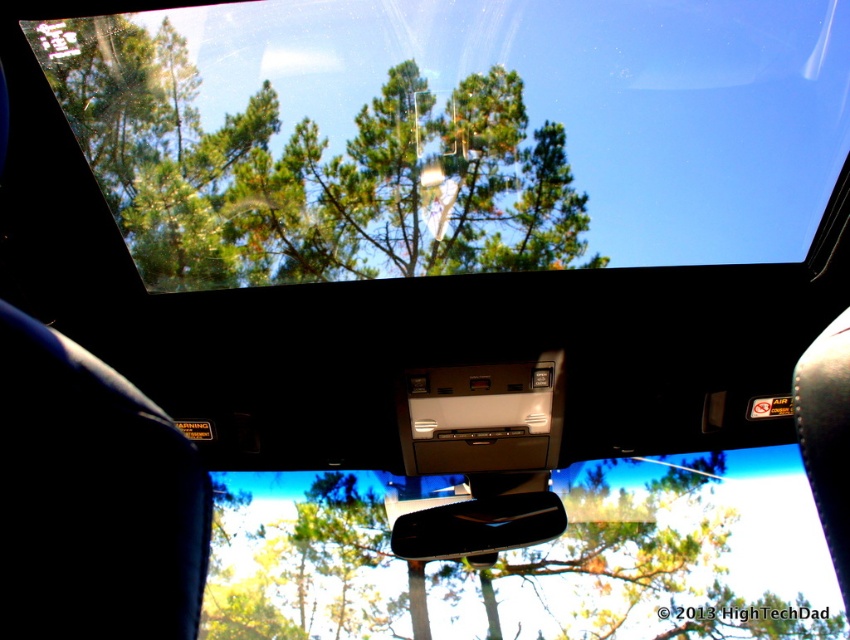
Question: Which object is positioned closest to the transparent glass windshield at upper center?

Choices:
 (A) black glossy car mirror at center
 (B) green matte tree at center

Answer: (A)

Question: Does green matte tree at center have a lesser width compared to black glossy car mirror at center?

Choices:
 (A) no
 (B) yes

Answer: (A)

Question: Can you confirm if transparent glass windshield at upper center is positioned above green matte tree at center?

Choices:
 (A) no
 (B) yes

Answer: (B)

Question: Which object appears closest to the camera in this image?

Choices:
 (A) black glossy car mirror at center
 (B) green matte tree at center
 (C) transparent glass windshield at upper center

Answer: (C)

Question: Can you confirm if green matte tree at center is wider than black glossy car mirror at center?

Choices:
 (A) yes
 (B) no

Answer: (A)

Question: Which of these objects is positioned farthest from the black glossy car mirror at center?

Choices:
 (A) transparent glass windshield at upper center
 (B) green matte tree at center

Answer: (B)